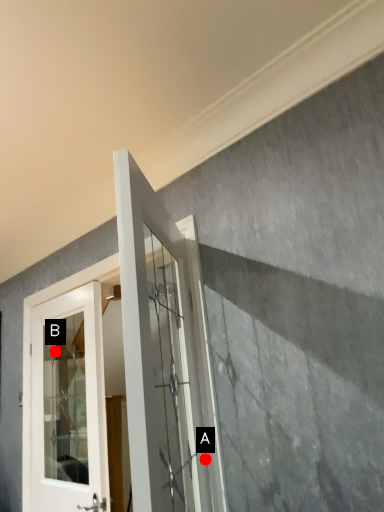
Question: Two points are circled on the image, labeled by A and B beside each circle. Which point appears closest to the camera in this image?

Choices:
 (A) A is closer
 (B) B is closer

Answer: (A)